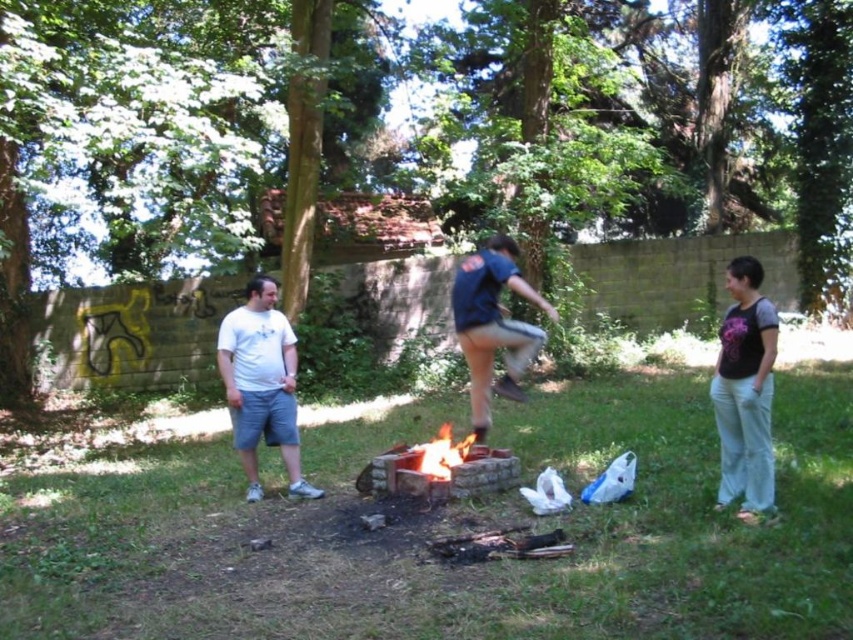
Question: Which object appears closest to the camera in this image?

Choices:
 (A) flaming wood at center
 (B) matte black shirt at lower right
 (C) white matte shorts at left

Answer: (B)

Question: Can you confirm if matte black shirt at lower right is positioned below white matte shorts at left?

Choices:
 (A) yes
 (B) no

Answer: (B)

Question: Among these points, which one is farthest from the camera?

Choices:
 (A) (421, 468)
 (B) (762, 273)
 (C) (283, 410)
 (D) (527, 360)

Answer: (C)

Question: Does white matte shorts at left have a smaller size compared to flaming wood at center?

Choices:
 (A) yes
 (B) no

Answer: (B)

Question: Which point appears closest to the camera in this image?

Choices:
 (A) (762, 481)
 (B) (271, 397)
 (C) (416, 467)

Answer: (A)

Question: Is matte black shirt at lower right to the right of dark blue shirt at center from the viewer's perspective?

Choices:
 (A) no
 (B) yes

Answer: (B)